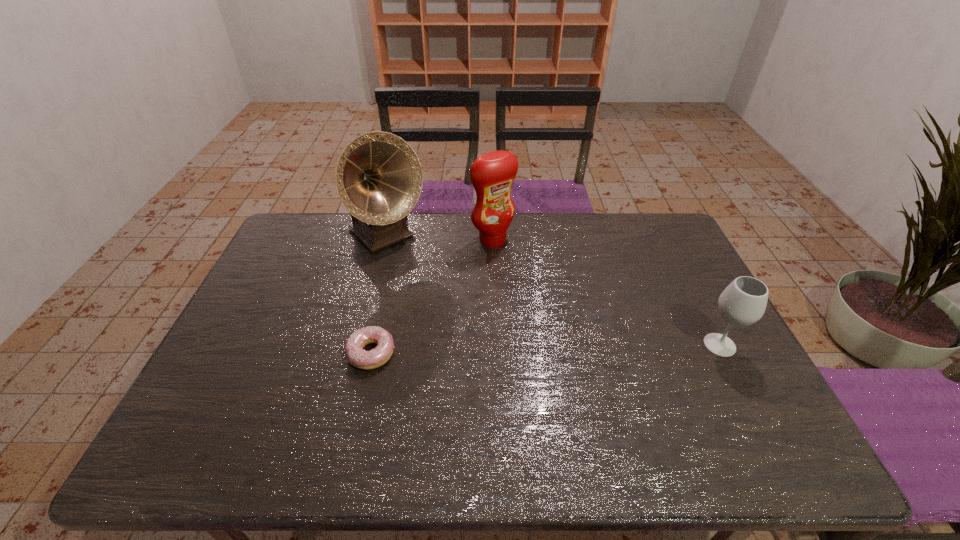
The width and height of the screenshot is (960, 540). Identify the location of doughnut. 360,358.

The width and height of the screenshot is (960, 540). In order to click on the third tallest object in this screenshot , I will do `click(743, 302)`.

You are a GUI agent. You are given a task and a screenshot of the screen. Output one action in this format:
    pyautogui.click(x=<x>, y=<y>)
    Task: Click on the wineglass
    The image size is (960, 540).
    Given the screenshot: What is the action you would take?
    pyautogui.click(x=743, y=302)

Find the location of a particular element. Image resolution: width=960 pixels, height=540 pixels. condiment is located at coordinates (492, 174).

Locate an element on the screen. the second object from right to left is located at coordinates (492, 174).

Where is `the tallest object`? the tallest object is located at coordinates (379, 178).

The image size is (960, 540). Find the location of `free space located 0.110m on the front of the doughnut`. free space located 0.110m on the front of the doughnut is located at coordinates (358, 411).

The width and height of the screenshot is (960, 540). What are the coordinates of `free region located on the back of the third tallest object` in the screenshot? It's located at (x=686, y=280).

What are the coordinates of `vacant area situated 0.270m on the label side of the second tallest object` in the screenshot? It's located at (552, 298).

Image resolution: width=960 pixels, height=540 pixels. I want to click on free space located 0.200m on the label side of the second tallest object, so point(539,284).